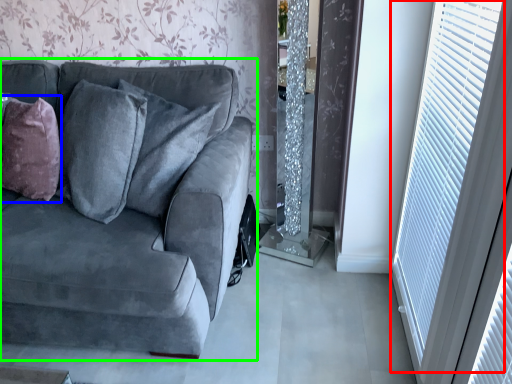
Question: Which is nearer to the window (highlighted by a red box)? throw pillow (highlighted by a blue box) or studio couch (highlighted by a green box).

Choices:
 (A) throw pillow
 (B) studio couch

Answer: (B)